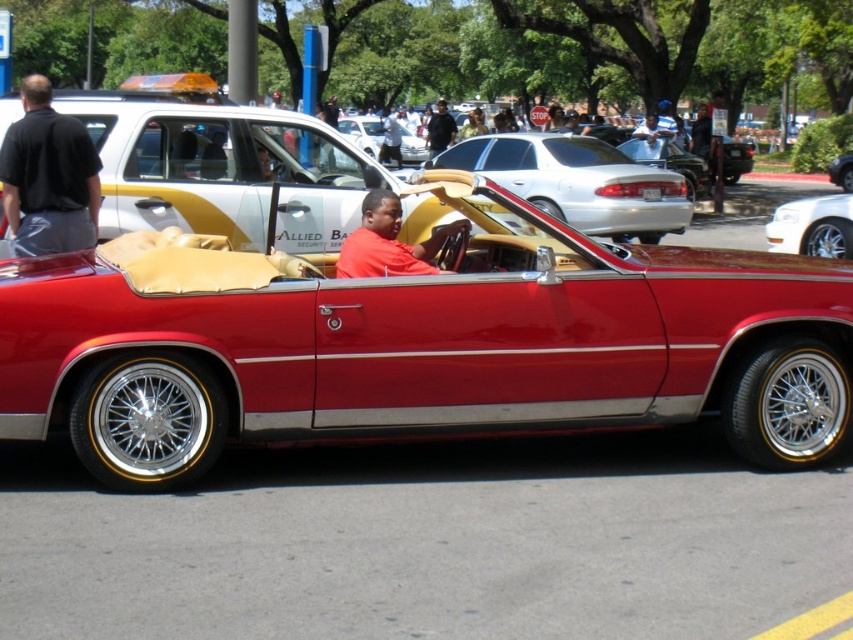
Based on the photo, who is positioned more to the right, matte red shirt at center or shiny beige leather convertible at center?

matte red shirt at center

Does matte red shirt at center have a smaller size compared to shiny beige leather convertible at center?

Actually, matte red shirt at center might be larger than shiny beige leather convertible at center.

Image resolution: width=853 pixels, height=640 pixels. In order to click on matte red shirt at center in this screenshot , I will do (x=389, y=241).

Does point (813, 243) come closer to viewer compared to point (357, 145)?

Yes, point (813, 243) is closer to viewer.

Based on the photo, measure the distance between point (x=791, y=232) and camera.

Point (x=791, y=232) is 36.03 feet away from camera.

At what (x,y) coordinates should I click in order to perform the action: click on white glossy sedan at right. Please return your answer as a coordinate pair (x, y). Image resolution: width=853 pixels, height=640 pixels. Looking at the image, I should click on (811, 227).

Who is positioned more to the right, shiny red convertible at center or shiny beige leather convertible at center?

shiny red convertible at center is more to the right.

Is point (39, 362) less distant than point (415, 154)?

Yes.

The width and height of the screenshot is (853, 640). I want to click on shiny red convertible at center, so [416, 342].